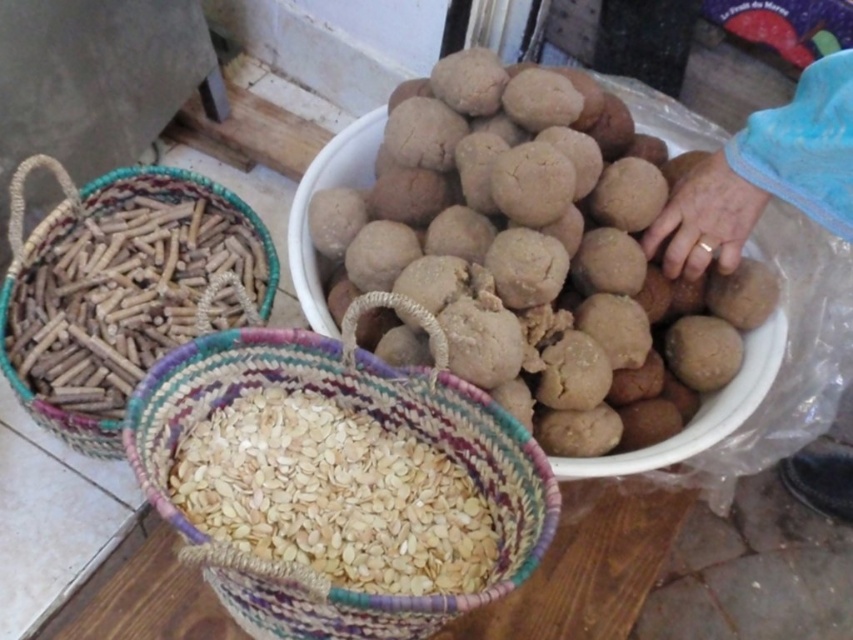
Question: In this image, where is blue fabric hand at right located relative to brown woven basket at left?

Choices:
 (A) below
 (B) above

Answer: (B)

Question: Which of the following is the closest to the observer?

Choices:
 (A) light brown woven basket at lower center
 (B) blue fabric hand at right
 (C) brown woven basket at left
 (D) braided straw basket filled with seeds at center

Answer: (D)

Question: Which object is the farthest from the brown matte dough balls at center?

Choices:
 (A) light brown woven basket at lower center
 (B) blue fabric hand at right
 (C) braided straw basket filled with seeds at center

Answer: (A)

Question: Does braided straw basket filled with seeds at center come in front of blue fabric hand at right?

Choices:
 (A) no
 (B) yes

Answer: (B)

Question: Does brown matte dough balls at center appear on the left side of braided straw basket filled with seeds at center?

Choices:
 (A) no
 (B) yes

Answer: (A)

Question: Estimate the real-world distances between objects in this image. Which object is farther from the brown woven basket at left?

Choices:
 (A) brown matte dough balls at center
 (B) braided straw basket filled with seeds at center
 (C) light brown woven basket at lower center

Answer: (A)